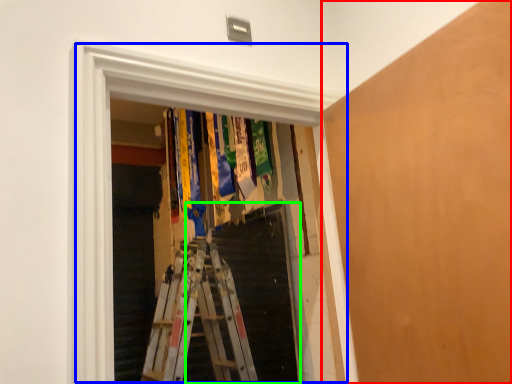
Question: Which object is positioned farthest from plywood (highlighted by a red box)? Select from window (highlighted by a blue box) and stairs (highlighted by a green box).

Choices:
 (A) window
 (B) stairs

Answer: (B)